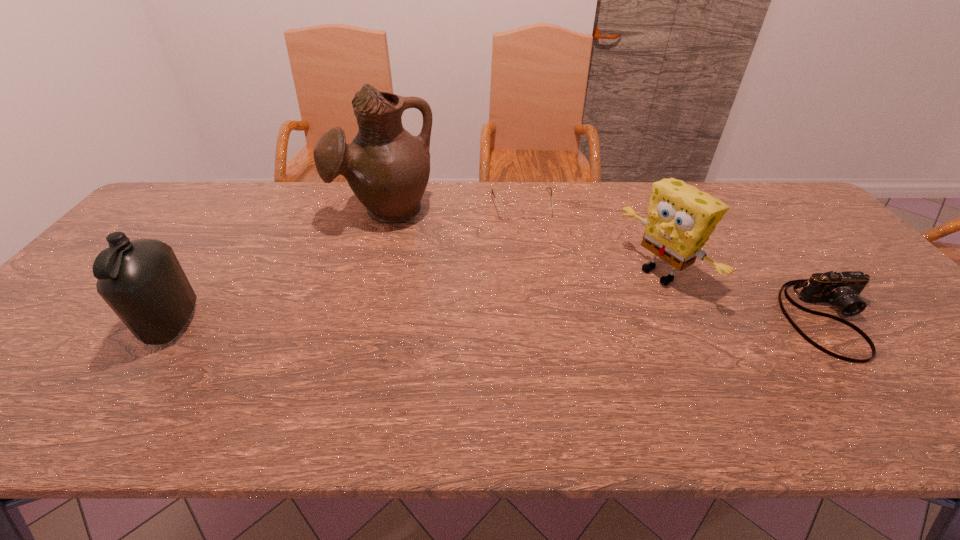
What are the coordinates of `empty location between the fourth tallest object and the bottle` in the screenshot? It's located at (502, 321).

This screenshot has width=960, height=540. I want to click on free spot between the bottle and the tallest object, so click(279, 267).

In order to click on free space between the tallest object and the camera in this screenshot , I will do `click(609, 265)`.

At what (x,y) coordinates should I click in order to perform the action: click on the third closest object to the pitcher. Please return your answer as a coordinate pair (x, y). This screenshot has height=540, width=960. Looking at the image, I should click on (680, 220).

Identify the location of object that is the third closest to the camera. (387, 168).

Identify the location of free point that satisfies the following two spatial constraints: 1. on the back side of the leftmost object; 2. on the right side of the shortest object. This screenshot has width=960, height=540. (255, 204).

At what (x,y) coordinates should I click in order to perform the action: click on free spot that satisfies the following two spatial constraints: 1. on the back side of the leftmost object; 2. on the left side of the fourth object from left to right. Please return your answer as a coordinate pair (x, y). The height and width of the screenshot is (540, 960). Looking at the image, I should click on (207, 273).

At what (x,y) coordinates should I click in order to perform the action: click on free point that satisfies the following two spatial constraints: 1. on the front side of the tallest object; 2. on the right side of the sponge. Please return your answer as a coordinate pair (x, y). Image resolution: width=960 pixels, height=540 pixels. Looking at the image, I should click on (369, 273).